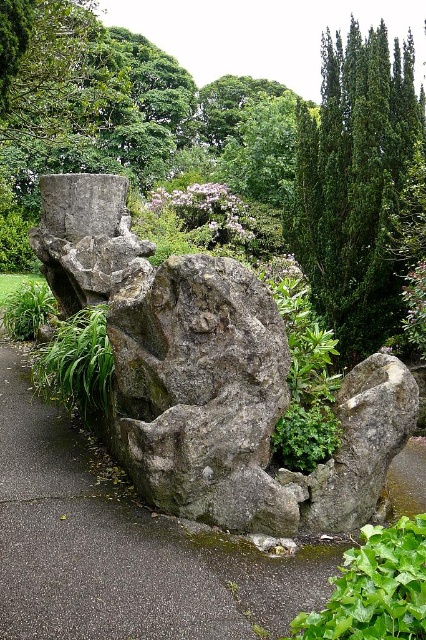
Question: Which of the following is the closest to the observer?

Choices:
 (A) (414, 532)
 (B) (244, 403)
 (C) (74, 358)

Answer: (A)

Question: Which point is farther from the camera taking this photo?

Choices:
 (A) (49, 604)
 (B) (83, 323)

Answer: (B)

Question: Does gray rough rock at center have a smaller size compared to green leafy bush at lower right?

Choices:
 (A) yes
 (B) no

Answer: (B)

Question: Which of the following is the farthest from the observer?

Choices:
 (A) gray rough rock at center
 (B) green textured tree at upper right

Answer: (B)

Question: Is gray rough rock at center above green leafy bush at lower right?

Choices:
 (A) yes
 (B) no

Answer: (A)

Question: Is green textured tree at upper right in front of green leafy bush at lower right?

Choices:
 (A) no
 (B) yes

Answer: (A)